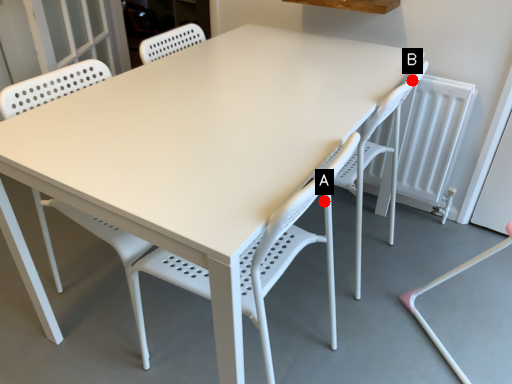
Question: Two points are circled on the image, labeled by A and B beside each circle. Which point is farther to the camera?

Choices:
 (A) A is further
 (B) B is further

Answer: (B)